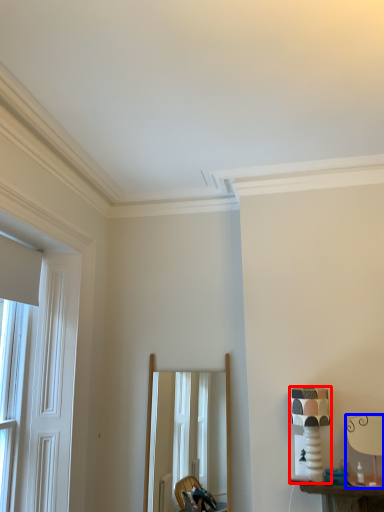
Question: Which point is closer to the camera, table lamp (highlighted by a red box) or table lamp (highlighted by a blue box)?

Choices:
 (A) table lamp
 (B) table lamp

Answer: (B)